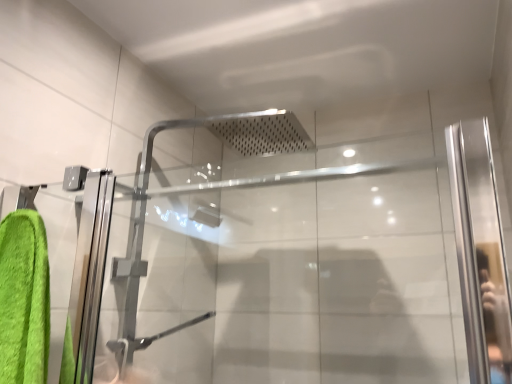
Based on the photo, what is the approximate width of satin chrome shower head at upper center?

17.25 inches.

Describe the element at coordinates (284, 261) in the screenshot. I see `satin chrome shower head at upper center` at that location.

This screenshot has width=512, height=384. I want to click on satin chrome shower head at upper center, so click(x=284, y=261).

Find the location of a particular element. satin chrome shower head at upper center is located at coordinates pos(284,261).